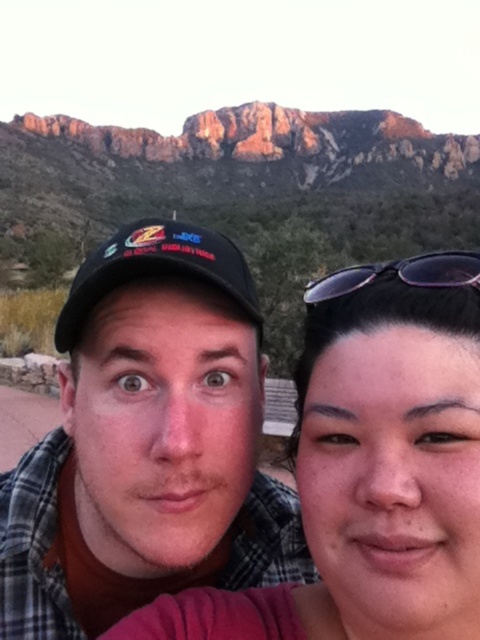
You are a photographer trying to capture the reflection of the plaid shirt at center and the purple plastic sunglasses at upper right in a nearby mirror. Which object will appear higher in the mirror?

The purple plastic sunglasses at upper right will appear higher in the mirror because the plaid shirt at center is below it.

You are trying to decide where to place a new accessory in the scene. The plaid shirt at center and purple plastic sunglasses at upper right are already in the image. Which object is positioned more to the left side?

The plaid shirt at center is positioned to the left of the purple plastic sunglasses at upper right, so it is more to the left side.

Looking at this image, you are a photographer trying to capture a group photo of two people standing 16.80 feet apart. The scene includes a plaid shirt at center and a black matte baseball cap at center. If you want to ensure both subjects are in focus, which camera setting adjustment would best achieve this?

To ensure both the plaid shirt at center and the black matte baseball cap at center are in focus when they are 16.80 feet apart, you should use a smaller aperture setting. A smaller aperture increases the depth of field, allowing both subjects to remain sharp and in focus.